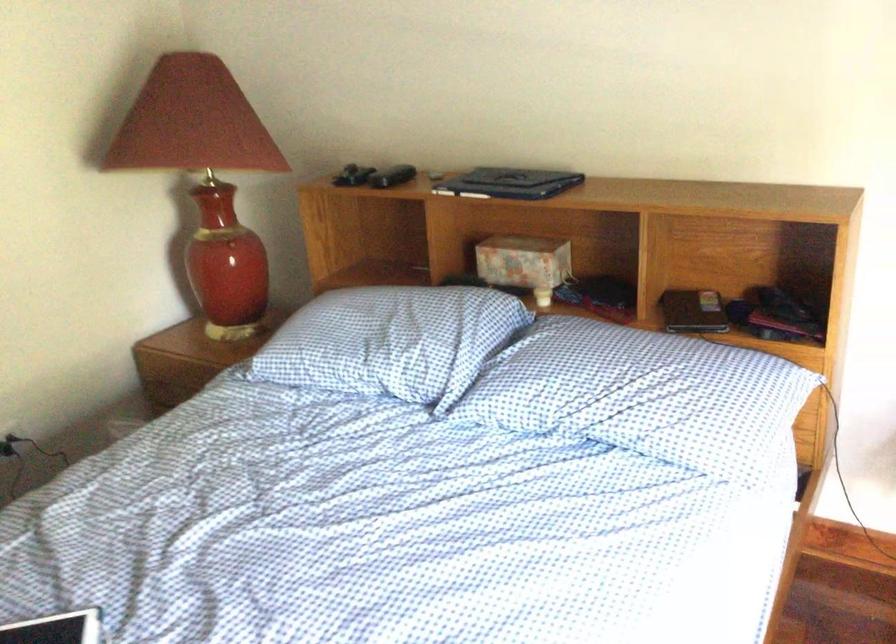
Where is `closed laptop`? The width and height of the screenshot is (896, 644). closed laptop is located at coordinates (510, 183).